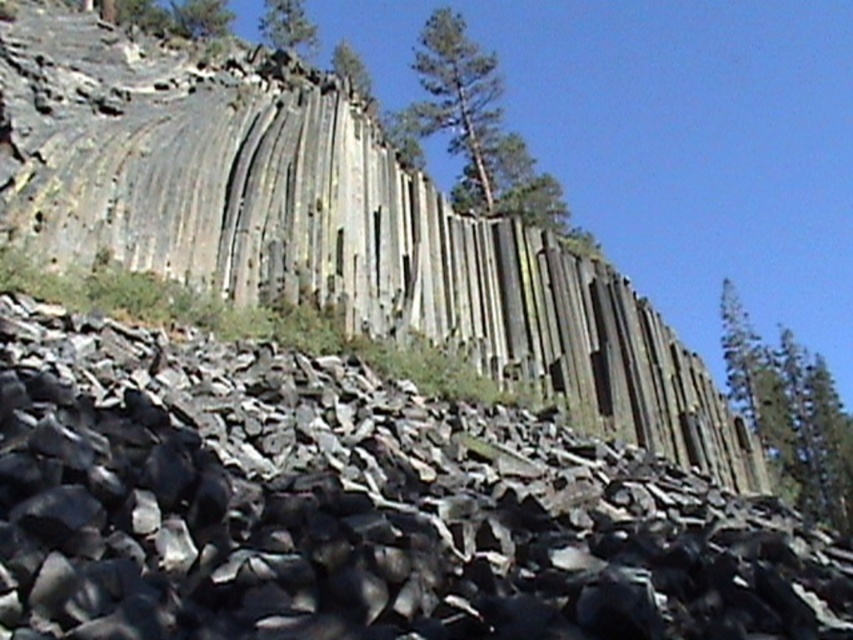
Does point (74, 236) lie in front of point (294, 28)?

Yes, point (74, 236) is closer to viewer.

This screenshot has width=853, height=640. Find the location of `gray rock formation at upper center`. gray rock formation at upper center is located at coordinates (325, 225).

Looking at this image, who is positioned more to the right, gray rock formation at upper center or green textured tree at upper right?

From the viewer's perspective, green textured tree at upper right appears more on the right side.

Is gray rock formation at upper center positioned at the back of green textured tree at upper right?

No, gray rock formation at upper center is in front of green textured tree at upper right.

Measure the distance between gray rock formation at upper center and camera.

gray rock formation at upper center and camera are 13.32 meters apart.

Image resolution: width=853 pixels, height=640 pixels. I want to click on gray rock formation at upper center, so click(x=325, y=225).

Between black rock pile at lower left and green textured tree at upper center, which one appears on the right side from the viewer's perspective?

black rock pile at lower left

Between point (218, 593) and point (496, 196), which one is positioned in front?

Positioned in front is point (218, 593).

You are a GUI agent. You are given a task and a screenshot of the screen. Output one action in this format:
    pyautogui.click(x=<x>, y=<y>)
    Task: Click on the black rock pile at lower left
    
    Given the screenshot: What is the action you would take?
    pyautogui.click(x=355, y=508)